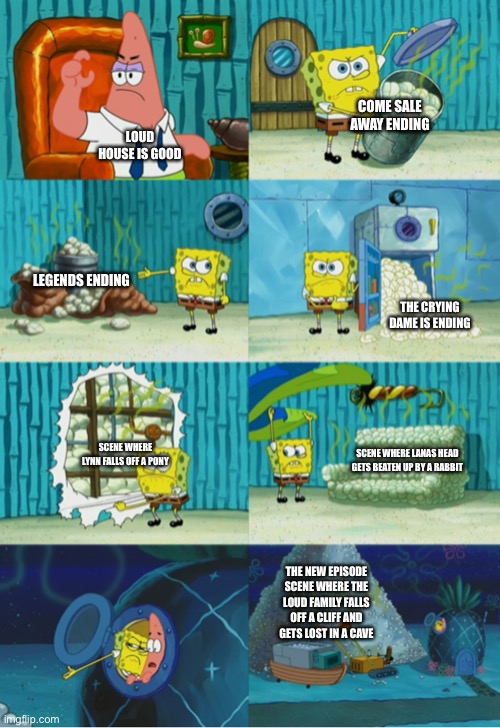
Where is `floor`? Image resolution: width=500 pixels, height=728 pixels. floor is located at coordinates (473, 154).